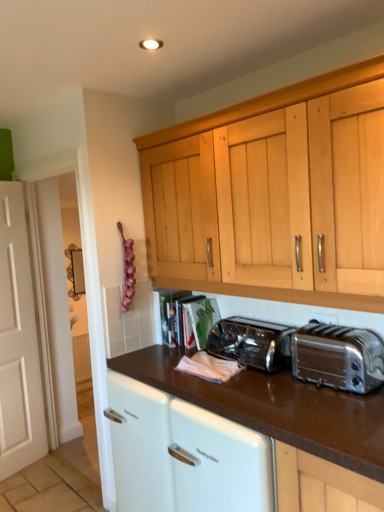
The height and width of the screenshot is (512, 384). I want to click on vacant area on top of brown glossy countertop at center (from a real-world perspective), so click(258, 375).